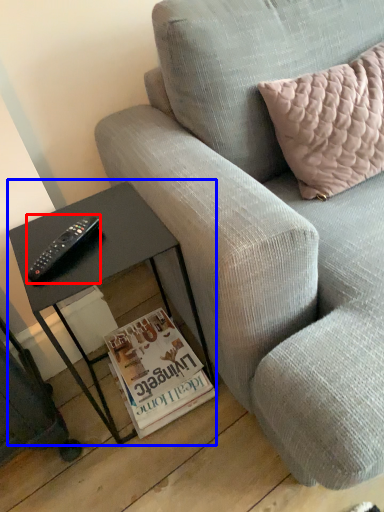
Question: Which point is further to the camera, remote (highlighted by a red box) or table (highlighted by a blue box)?

Choices:
 (A) remote
 (B) table

Answer: (A)